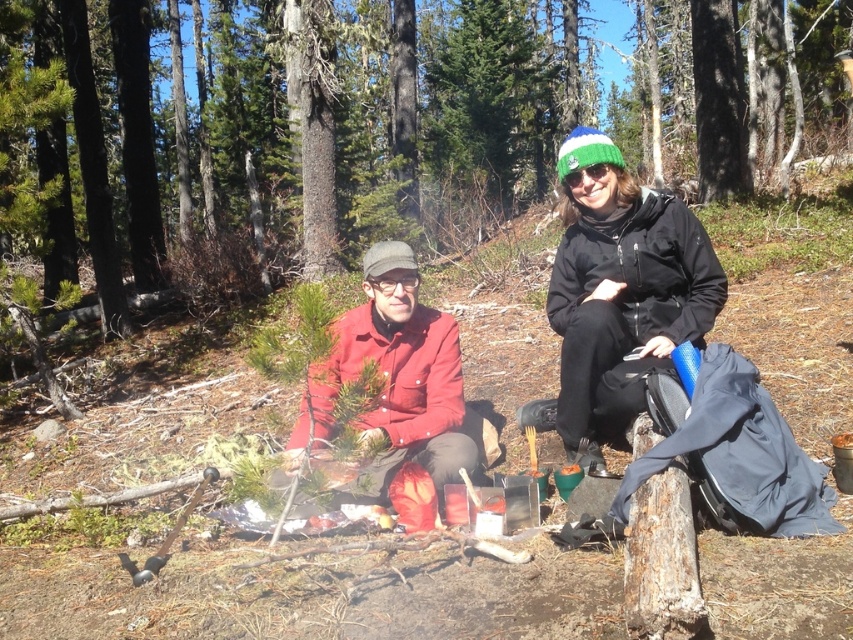
You are planning to take a photo of the two campers in the forest. You need to ensure that both the black matte jacket at center and the matte red shirt at center are visible in the frame. Based on their positions, which one might appear larger in the photo?

The black matte jacket at center appears larger in the photo because it is taller than the matte red shirt at center.